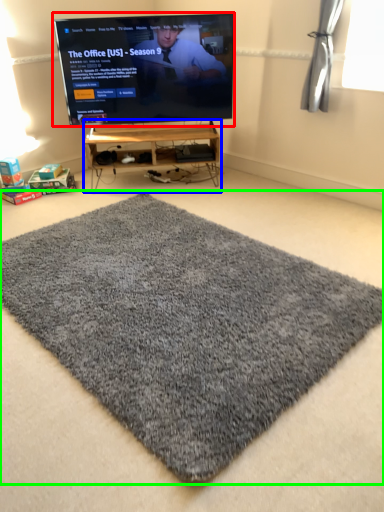
Question: Which object is positioned farthest from television (highlighted by a red box)? Select from furniture (highlighted by a blue box) and mat (highlighted by a green box).

Choices:
 (A) furniture
 (B) mat

Answer: (B)